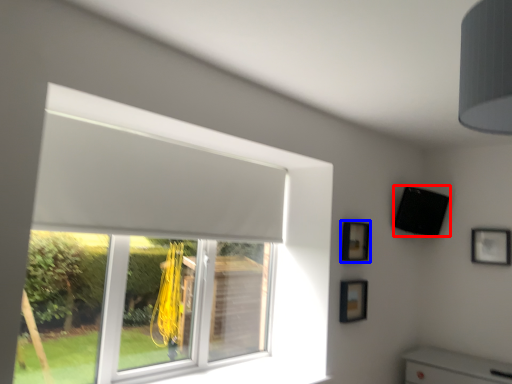
Question: Which of the following is the farthest to the observer, speaker (highlighted by a red box) or picture frame (highlighted by a blue box)?

Choices:
 (A) speaker
 (B) picture frame

Answer: (A)